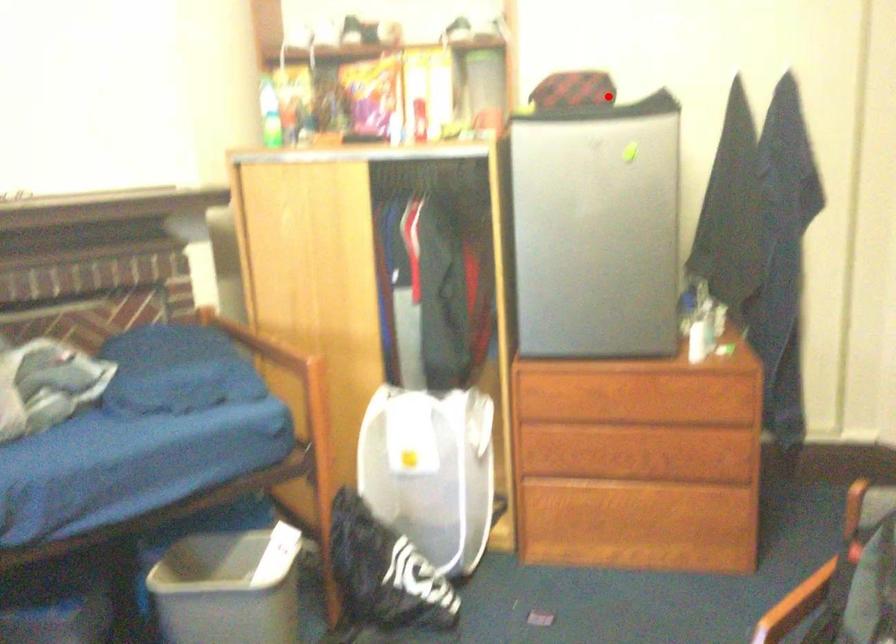
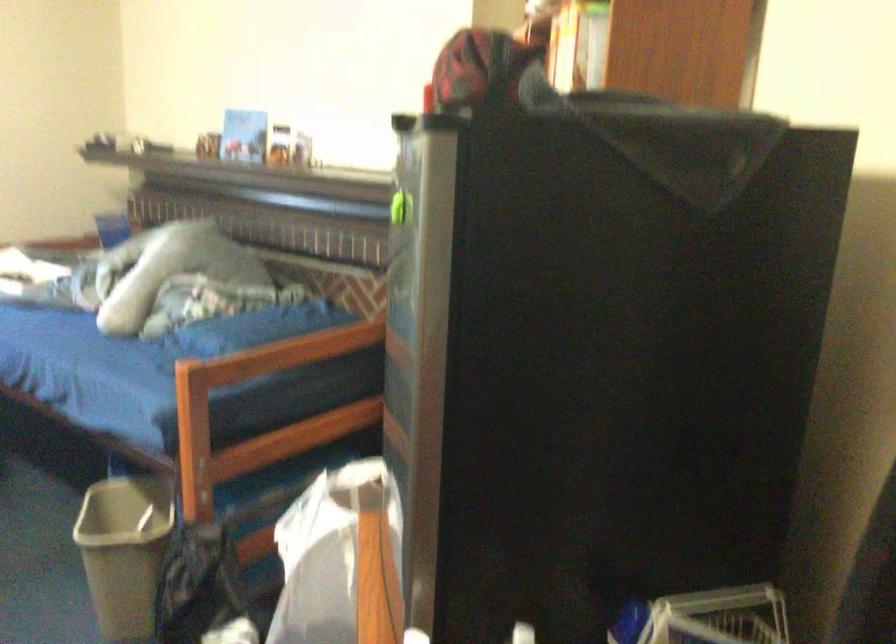
Locate, in the second image, the point that corresponds to the highlighted location in the first image.

(478, 68)